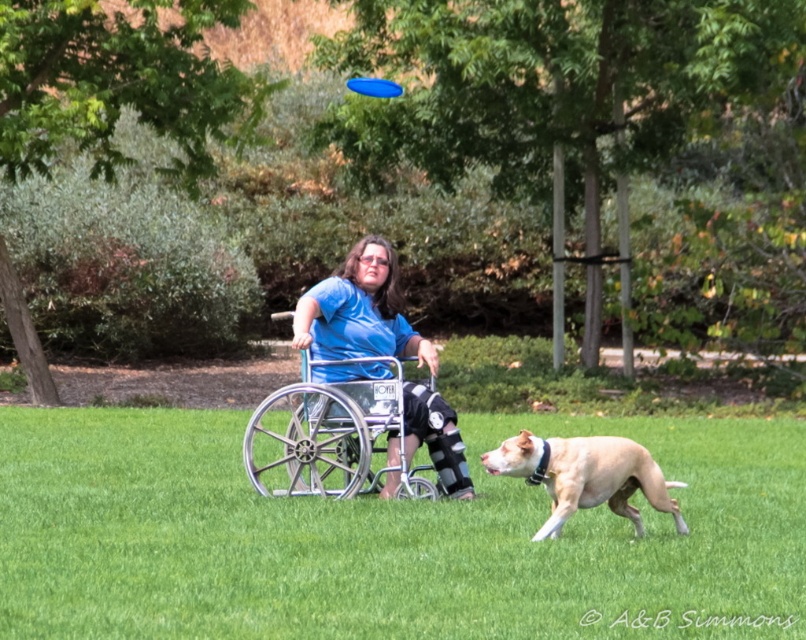
You are a park visitor who wants to walk through the area. Can you walk on the green grass at center without stepping on the silver metallic wheelchair at center?

The green grass at center is below the silver metallic wheelchair at center, so you can walk on the green grass at center without stepping on the silver metallic wheelchair at center because the wheelchair is positioned above it.

You are a photographer trying to capture the perfect shot of the frisbee and the dog in the park scene. You need to know which of the two points, point 1 at coordinates point (318,392) or point 2 at coordinates point (379,84), is closer to you to ensure proper focus. Which point should you focus on?

Point 1 at coordinates point (318,392) is closer to the viewer than point 2 at coordinates point (379,84), so you should focus on point 1 at coordinates point (318,392) for proper focus.